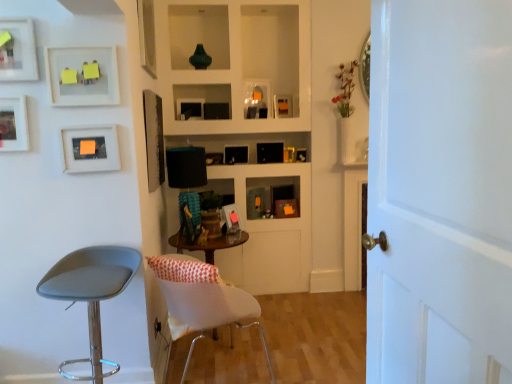
Question: Is point (76, 274) closer or farther from the camera than point (224, 206)?

Choices:
 (A) farther
 (B) closer

Answer: (B)

Question: Looking at the image, does gray leather stool at left, the 2th chair when ordered from right to left, seem bigger or smaller compared to matte black picture frame at center, arranged as the 7th picture frame when viewed from the front?

Choices:
 (A) big
 (B) small

Answer: (A)

Question: Which is farther from the white fabric chair at center, which is the 2th chair from left to right?

Choices:
 (A) matte black picture frame at upper center, acting as the 3th picture frame starting from the back
 (B) matte black picture frame at center, the fourth picture frame from the back
 (C) matte black picture frame at center, arranged as the 6th picture frame when viewed from the front
 (D) matte black picture frame at upper center, which ranks as the 1th picture frame in back-to-front order
 (E) matte white picture frame at left, the 8th picture frame viewed from the back

Answer: (D)

Question: Which object is positioned farthest from the matte black picture frame at upper center, marked as the 9th picture frame in a front-to-back arrangement?

Choices:
 (A) matte white picture frame at left, the 8th picture frame viewed from the back
 (B) green glossy vase at upper center
 (C) matte orange paper at upper left, arranged as the 4th picture frame when viewed from the front
 (D) matte black picture frame at upper center, acting as the 3th picture frame starting from the back
 (E) white painted wood door at right

Answer: (E)